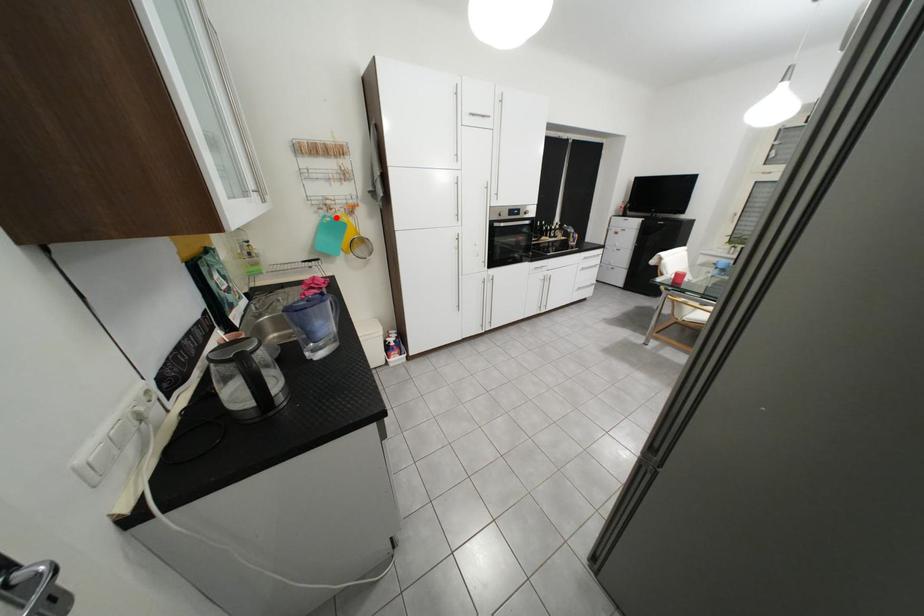
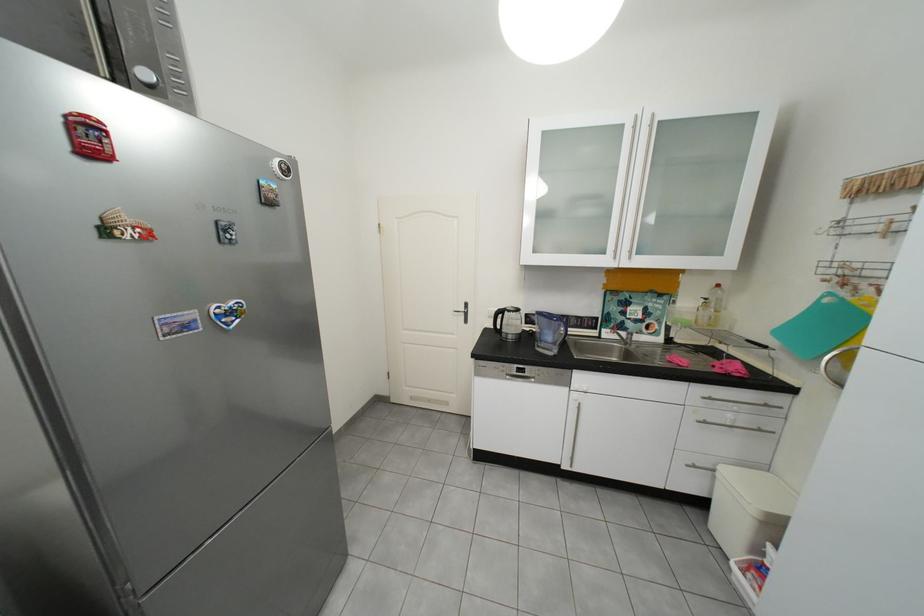
Question: I am providing you with two images of the same scene from different viewpoints. Given a red point in image1, look at the same physical point in image2. Is it:

Choices:
 (A) Closer to the viewpoint
 (B) Farther from the viewpoint

Answer: (B)